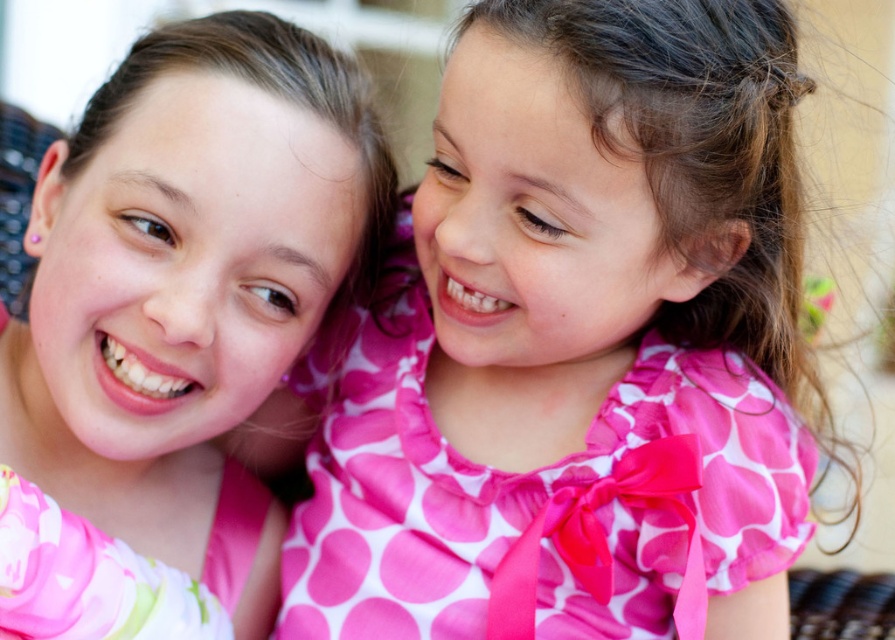
Is pink polka dot dress at center bigger than pink fabric at upper left?

Yes, pink polka dot dress at center is bigger than pink fabric at upper left.

Measure the distance from pink polka dot dress at center to pink fabric at upper left.

pink polka dot dress at center and pink fabric at upper left are 7.90 inches apart.

Does point (440, 212) lie behind point (234, 580)?

No, it is in front of (234, 580).

Image resolution: width=895 pixels, height=640 pixels. I want to click on pink polka dot dress at center, so click(576, 333).